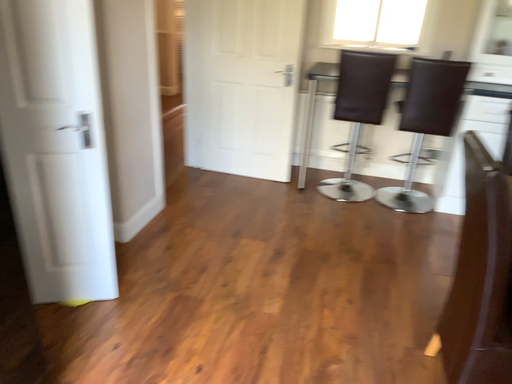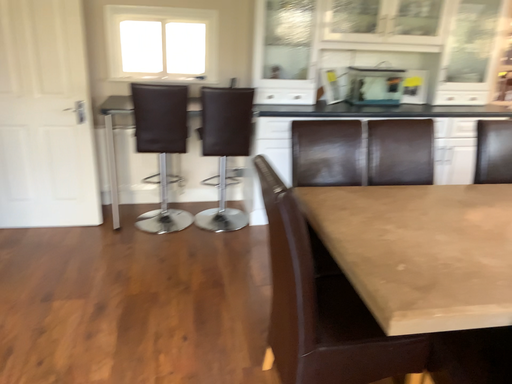
Question: Which way did the camera rotate in the video?

Choices:
 (A) rotated left
 (B) rotated right

Answer: (B)